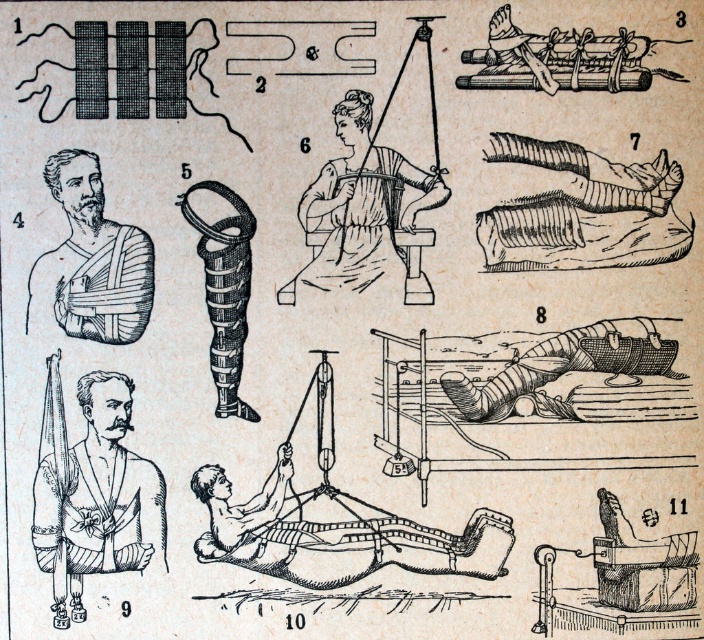
Based on the scene description, where is the wooden board at center located in the image?

The wooden board at center is located at point 0.834 on the x axis and 0.479 on the y axis.

You are a physical therapist trying to place a 12 inch long medical tool between the wooden board at center and the matte brown bandages at center. Can the tool fit without bending?

The distance between the wooden board at center and the matte brown bandages at center is 15.22 inches, which is greater than the tool length of 12 inches. The tool can fit without bending.

Based on the photo, you are a physical therapist examining the illustration. You need to determine the spatial relationship between the wooden board at center and the matte brown bandages at center. Which object is located below the other?

The wooden board at center is positioned under matte brown bandages at center, so the wooden board is below the bandages.